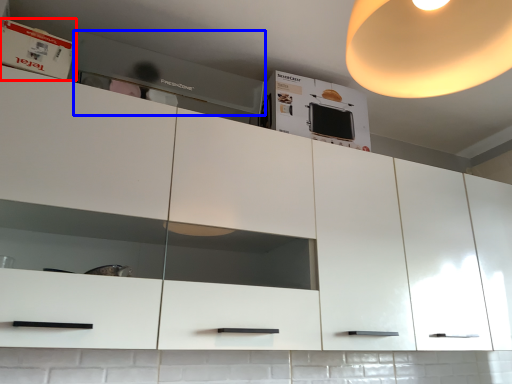
Question: Which of the following is the farthest to the observer, cabinet (highlighted by a red box) or home appliance (highlighted by a blue box)?

Choices:
 (A) cabinet
 (B) home appliance

Answer: (B)